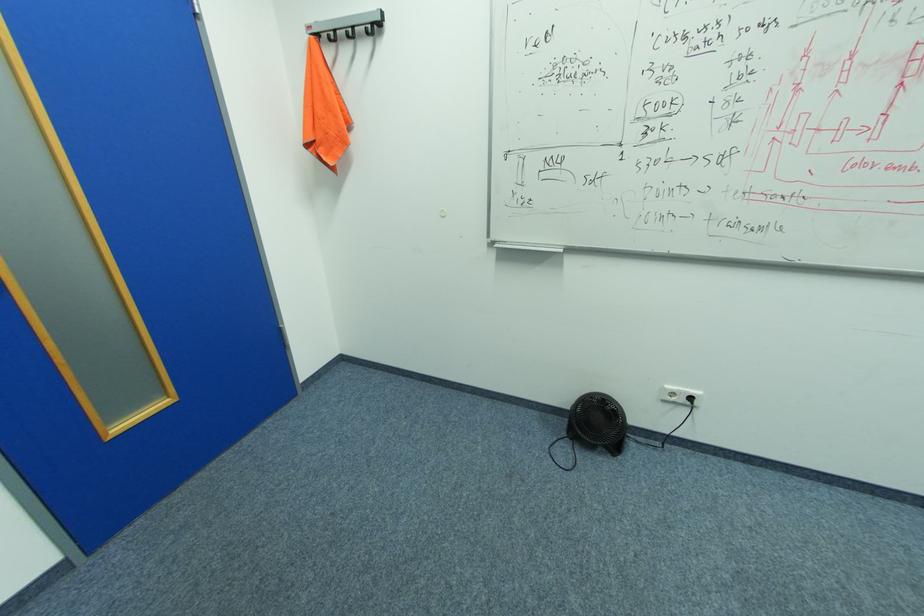
What are the coordinates of `electrical outlet socket` in the screenshot? It's located at (671, 394).